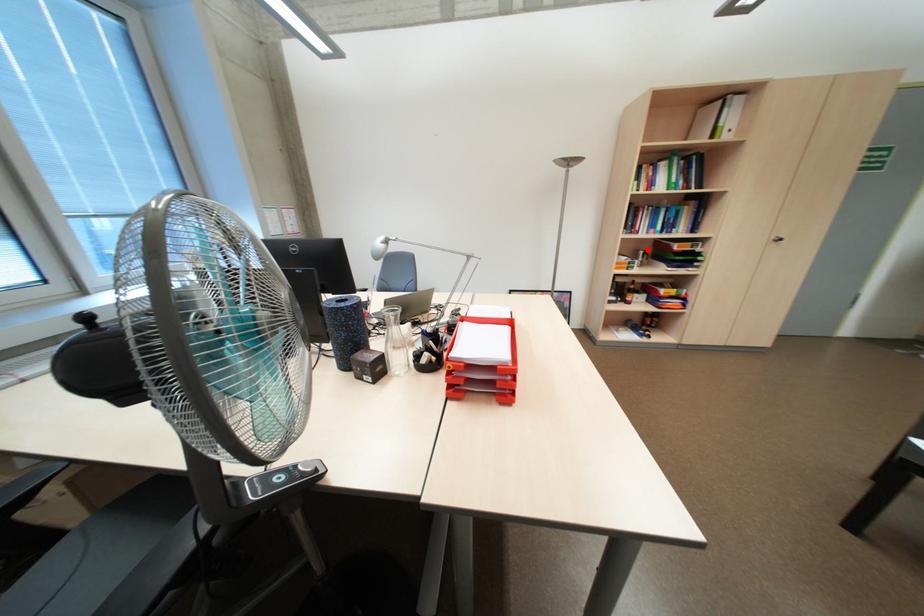
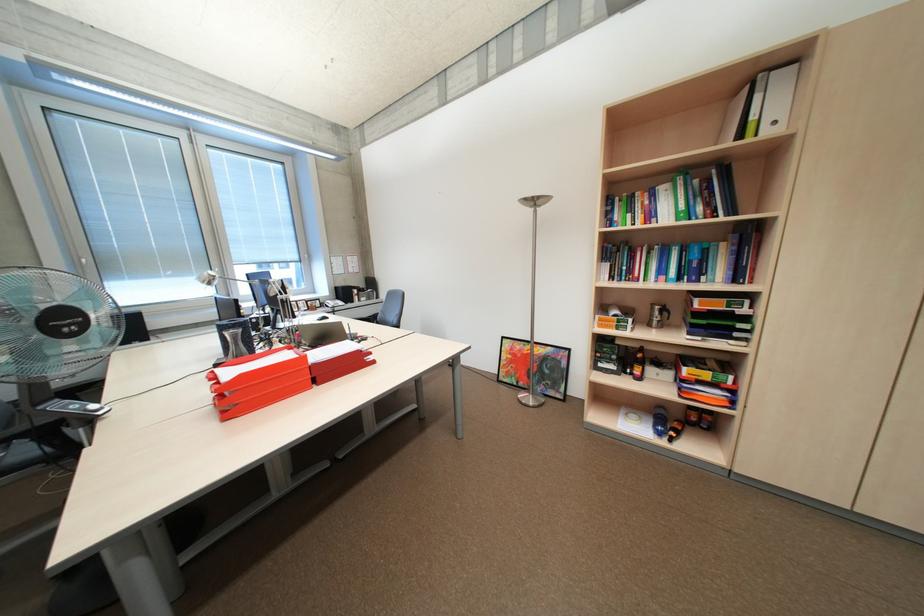
In the second image, find the point that corresponds to the highlighted location in the first image.

(663, 304)